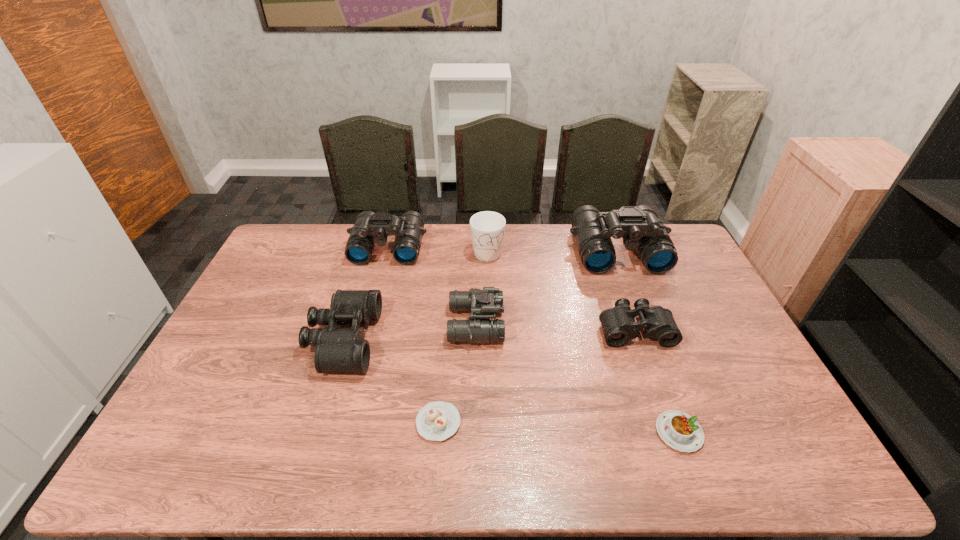
Locate an element on the screen. The width and height of the screenshot is (960, 540). the biggest blue binoculars is located at coordinates (641, 229).

Where is `the tallest object`? This screenshot has height=540, width=960. the tallest object is located at coordinates (641, 229).

Identify the location of the leftmost blue binoculars. The width and height of the screenshot is (960, 540). (370, 228).

Find the location of a particular element. This screenshot has height=540, width=960. the fourth shortest binoculars is located at coordinates (370, 228).

You are a GUI agent. You are given a task and a screenshot of the screen. Output one action in this format:
    pyautogui.click(x=<x>, y=<y>)
    Task: Click on the mug
    
    Given the screenshot: What is the action you would take?
    pyautogui.click(x=487, y=228)

Locate an element on the screen. The width and height of the screenshot is (960, 540). the third binoculars from left to right is located at coordinates (484, 303).

Locate an element on the screen. Image resolution: width=960 pixels, height=540 pixels. the second blue binoculars from left to right is located at coordinates (484, 303).

The height and width of the screenshot is (540, 960). I want to click on the left black binoculars, so click(x=337, y=349).

What are the coordinates of `the smaller black binoculars` in the screenshot? It's located at (618, 323).

Find the location of `the sixth tallest object`. the sixth tallest object is located at coordinates (618, 323).